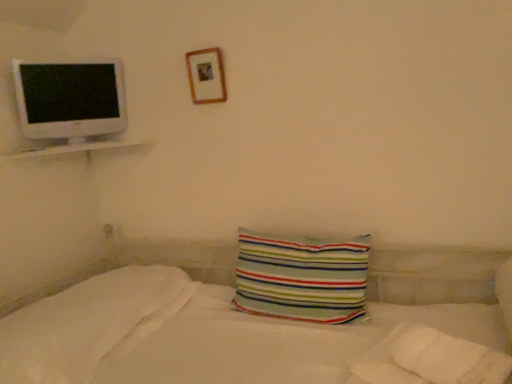
Question: From the image's perspective, is white soft pillow at lower left, the 2th pillow viewed from the right, above or below white glossy computer monitor at upper left?

Choices:
 (A) above
 (B) below

Answer: (B)

Question: In terms of size, does white soft pillow at lower left, the 2th pillow viewed from the right, appear bigger or smaller than white glossy computer monitor at upper left?

Choices:
 (A) small
 (B) big

Answer: (B)

Question: Estimate the real-world distances between objects in this image. Which object is farther from the striped fabric pillow at center, placed as the first pillow when sorted from right to left?

Choices:
 (A) white glossy shelf at upper left
 (B) wooden picture frame at upper center
 (C) white glossy computer monitor at upper left
 (D) white soft pillow at lower left, the 2th pillow viewed from the right

Answer: (C)

Question: Considering the real-world distances, which object is closest to the wooden picture frame at upper center?

Choices:
 (A) white glossy shelf at upper left
 (B) white glossy computer monitor at upper left
 (C) striped fabric pillow at center, which ranks as the second pillow in left-to-right order
 (D) white soft pillow at lower left, which is the 1th pillow from left to right

Answer: (A)